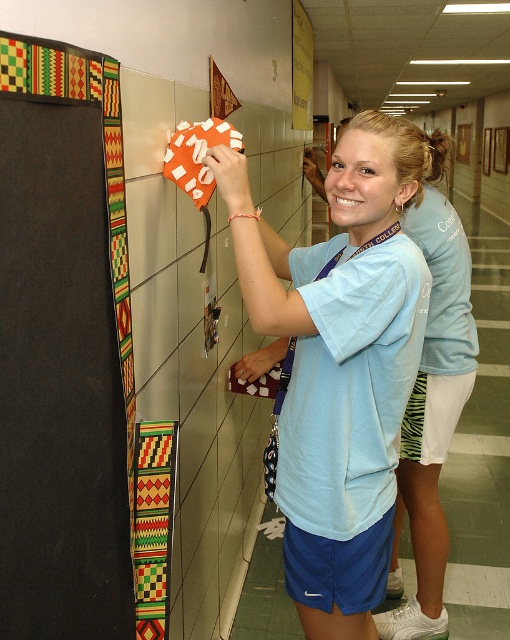
You are a painter who needs to clean the wall. You see the black fabric at left and the light blue fabric scrub at center. Which one is higher up on the wall?

The black fabric at left is located above the light blue fabric scrub at center, so it is higher up on the wall.

You are a fashion designer observing two clothing items in the scene. The light blue fabric scrub at center and the matte blue shirt at center. Which clothing item has a narrower width?

The light blue fabric scrub at center is thinner than the matte blue shirt at center, so the light blue fabric scrub at center has a narrower width.

You are a fashion designer observing two blue garments worn by a person in an image. The garments are the light blue fabric scrub at center and the matte blue shirt at center. Which garment is shorter in length?

The light blue fabric scrub at center is shorter than the matte blue shirt at center.